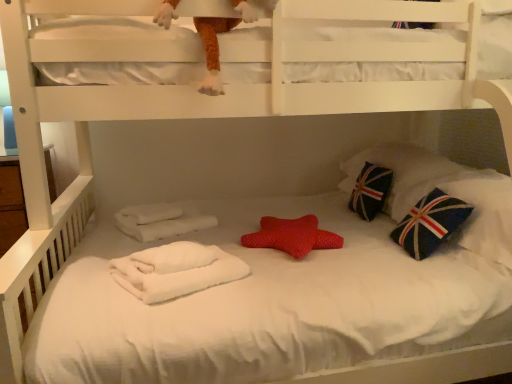
Question: Considering the positions of rubber star at center and blue fabric pillow with union jack design at right, positioned as the 1th pillow in back-to-front order, in the image, is rubber star at center taller or shorter than blue fabric pillow with union jack design at right, positioned as the 1th pillow in back-to-front order,?

Choices:
 (A) short
 (B) tall

Answer: (A)

Question: Based on their sizes in the image, would you say rubber star at center is bigger or smaller than blue fabric pillow with union jack design at right, marked as the second pillow in a front-to-back arrangement?

Choices:
 (A) big
 (B) small

Answer: (B)

Question: Which is nearer to the blue fabric pillow with union jack design at right, marked as the second pillow in a front-to-back arrangement?

Choices:
 (A) white fluffy towel at lower left
 (B) rubber star at center
 (C) fuzzy orange plush at upper center
 (D) dark blue fabric pillow with union jack design at right, the first pillow positioned from the front

Answer: (D)

Question: Which object is the farthest from the dark blue fabric pillow with union jack design at right, which is counted as the 2th pillow, starting from the back?

Choices:
 (A) fuzzy orange plush at upper center
 (B) rubber star at center
 (C) blue fabric pillow with union jack design at right, marked as the second pillow in a front-to-back arrangement
 (D) white fluffy towel at lower left

Answer: (A)